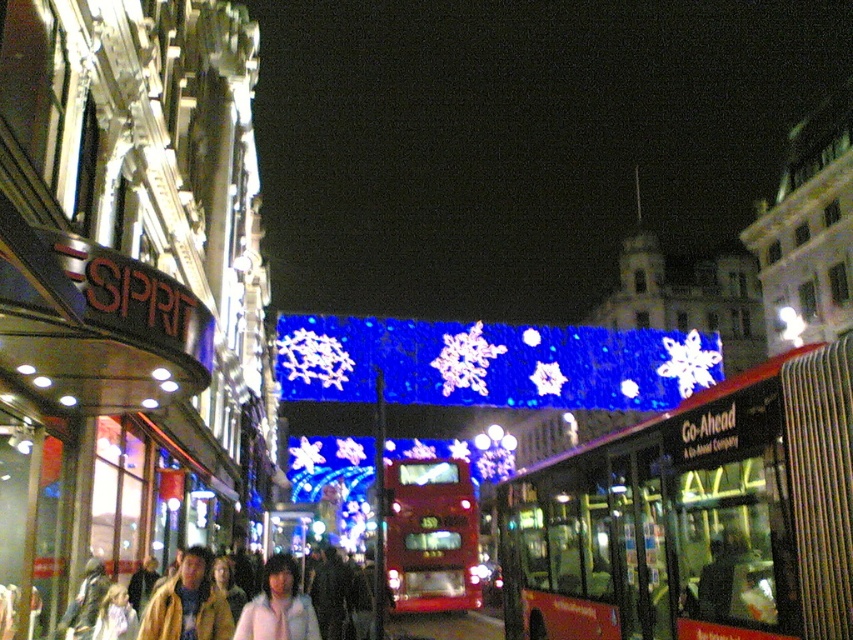
Can you confirm if red metallic bus at center is positioned to the right of leather jacket at lower left?

Yes, red metallic bus at center is to the right of leather jacket at lower left.

Is point (730, 634) positioned before point (215, 637)?

Yes, it is in front of point (215, 637).

Who is more forward, (541, 573) or (196, 579)?

Positioned in front is point (196, 579).

This screenshot has height=640, width=853. What are the coordinates of `red metallic bus at center` in the screenshot? It's located at (695, 516).

From the picture: Who is higher up, shiny red bus at center or leather jacket at lower left?

leather jacket at lower left is higher up.

Who is positioned more to the left, shiny red bus at center or leather jacket at lower left?

Positioned to the left is leather jacket at lower left.

Between point (399, 552) and point (160, 605), which one is positioned behind?

The point (399, 552) is behind.

Locate an element on the screen. The image size is (853, 640). shiny red bus at center is located at coordinates (430, 536).

Which is in front, point (186, 604) or point (268, 572)?

Point (186, 604)

Identify the location of leather jacket at lower left. (189, 604).

The height and width of the screenshot is (640, 853). Identify the location of leather jacket at lower left. (189, 604).